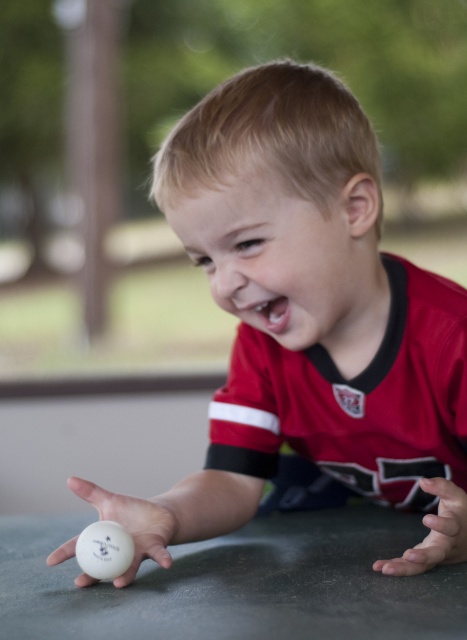
Question: Based on their relative distances, which object is nearer to the smooth skin hand at lower right?

Choices:
 (A) white smooth table at lower center
 (B) white matte ping pong ball at center
 (C) white matte ping pong ball at lower left

Answer: (A)

Question: From the image, what is the correct spatial relationship of white matte ping pong ball at lower left in relation to white smooth table at lower center?

Choices:
 (A) left
 (B) right

Answer: (B)

Question: Is white matte ping pong ball at lower left positioned at the back of white smooth table at lower center?

Choices:
 (A) yes
 (B) no

Answer: (A)

Question: Is white matte ping pong ball at center thinner than smooth skin hand at lower right?

Choices:
 (A) yes
 (B) no

Answer: (B)

Question: Which object is farther from the camera taking this photo?

Choices:
 (A) smooth skin hand at lower right
 (B) white matte ping pong ball at lower left

Answer: (B)

Question: Which point is farther from the camera taking this photo?

Choices:
 (A) (431, 557)
 (B) (148, 509)
 (C) (283, 256)

Answer: (B)